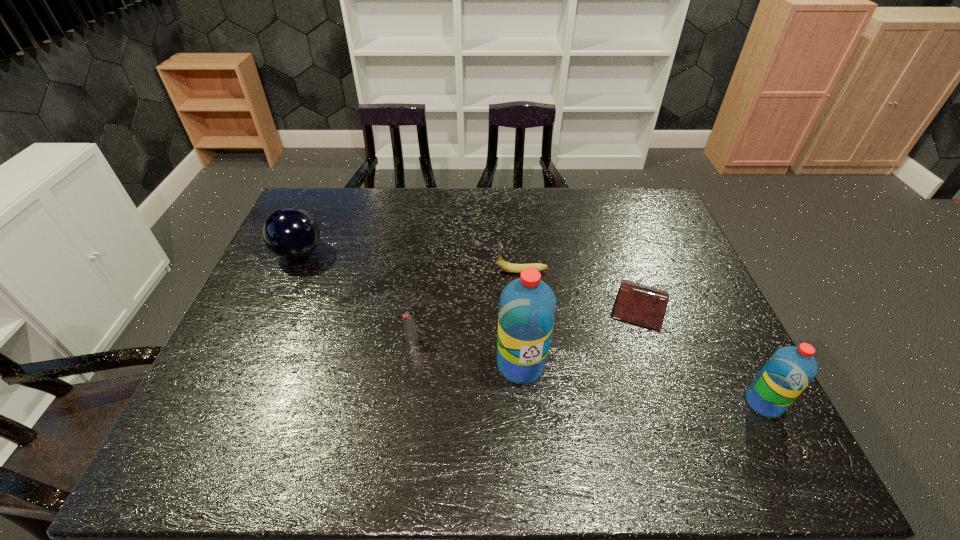
The width and height of the screenshot is (960, 540). I want to click on book located in the right edge section of the desktop, so tap(643, 305).

Where is `object that is positioned at the near right corner`? The height and width of the screenshot is (540, 960). object that is positioned at the near right corner is located at coordinates (787, 373).

Image resolution: width=960 pixels, height=540 pixels. Find the location of `vacant region at the far edge of the desktop`. vacant region at the far edge of the desktop is located at coordinates tap(555, 225).

Where is `vacant space at the near edge`? The height and width of the screenshot is (540, 960). vacant space at the near edge is located at coordinates (652, 393).

At what (x,y) coordinates should I click in order to perform the action: click on vacant area at the left edge of the desktop. Please return your answer as a coordinate pair (x, y). This screenshot has width=960, height=540. Looking at the image, I should click on (259, 323).

The height and width of the screenshot is (540, 960). What are the coordinates of `vacant position at the right edge of the desktop` in the screenshot? It's located at click(643, 251).

In the image, there is a desktop. Where is `vacant space at the far left corner`? This screenshot has height=540, width=960. vacant space at the far left corner is located at coordinates (320, 201).

In the image, there is a desktop. Identify the location of vacant space at the far right corner. The image size is (960, 540). (655, 202).

At what (x,y) coordinates should I click in order to perform the action: click on free space at the near right corner of the desktop. Please return your answer as a coordinate pair (x, y). The image size is (960, 540). Looking at the image, I should click on (718, 409).

Image resolution: width=960 pixels, height=540 pixels. What are the coordinates of `free point between the fifth object from right to left and the leftmost object` in the screenshot? It's located at (355, 296).